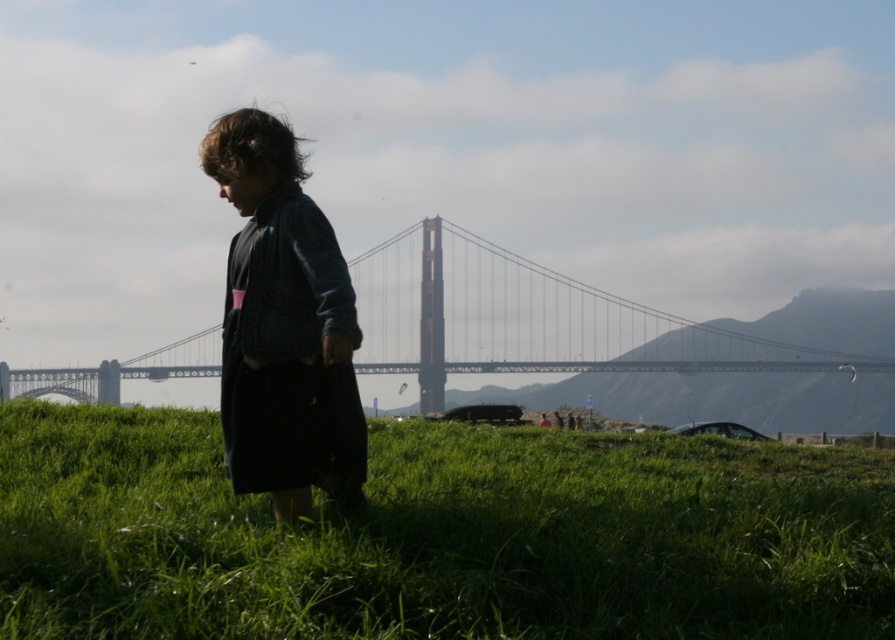
Measure the distance from green grassy field at lower center to metallic bridge at center.

142.11 feet

Describe the element at coordinates (439, 536) in the screenshot. This screenshot has height=640, width=895. I see `green grassy field at lower center` at that location.

Is point (149, 435) farther from viewer compared to point (546, 289)?

That is False.

The width and height of the screenshot is (895, 640). Identify the location of green grassy field at lower center. (439, 536).

Between metallic bridge at center and dark blue denim jacket at center, which one is positioned lower?

dark blue denim jacket at center

Who is taller, metallic bridge at center or dark blue denim jacket at center?

metallic bridge at center

Find the location of a particular element. Image resolution: width=895 pixels, height=640 pixels. metallic bridge at center is located at coordinates (534, 320).

Is green grassy field at lower center below dark blue denim jacket at center?

Indeed, green grassy field at lower center is positioned under dark blue denim jacket at center.

Who is higher up, green grassy field at lower center or dark blue denim jacket at center?

dark blue denim jacket at center is above.

Identify the location of green grassy field at lower center. click(x=439, y=536).

I want to click on green grassy field at lower center, so click(x=439, y=536).